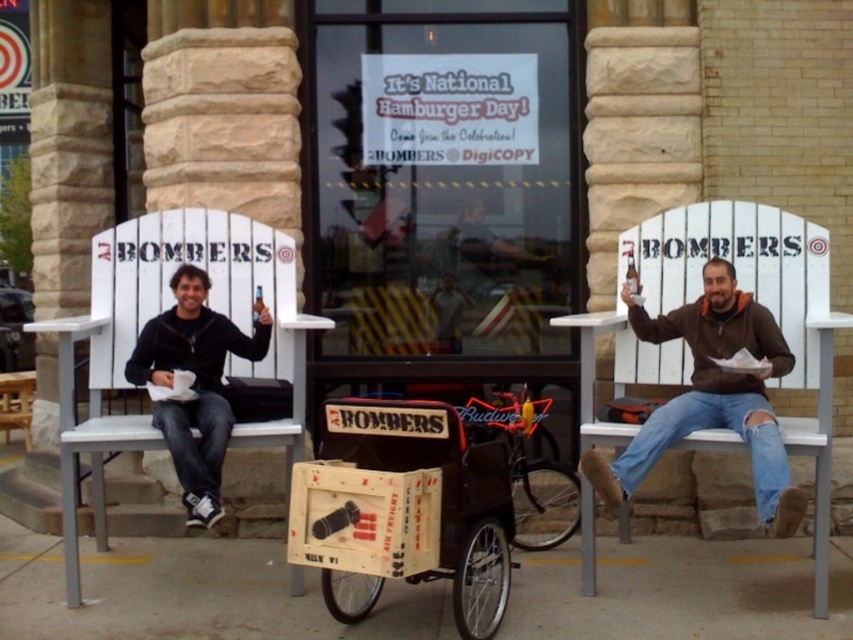
Does brown fuzzy jacket at right have a lesser width compared to neon red sign at center?

In fact, brown fuzzy jacket at right might be wider than neon red sign at center.

Between brown fuzzy jacket at right and neon red sign at center, which one has less height?

neon red sign at center

Between point (782, 538) and point (525, 474), which one is positioned in front?

Point (782, 538)

Where is `brown fuzzy jacket at right`? The width and height of the screenshot is (853, 640). brown fuzzy jacket at right is located at coordinates (711, 396).

Is white painted wood bench at left closer to the viewer compared to black matte jacket at left?

No.

At what (x,y) coordinates should I click in order to perform the action: click on white painted wood bench at left. Please return your answer as a coordinate pair (x, y). Image resolution: width=853 pixels, height=640 pixels. Looking at the image, I should click on (158, 307).

At what (x,y) coordinates should I click in order to perform the action: click on white painted wood bench at left. Please return your answer as a coordinate pair (x, y). The height and width of the screenshot is (640, 853). Looking at the image, I should click on (158, 307).

Which is more to the right, white painted wood bench at left or brown fuzzy jacket at right?

brown fuzzy jacket at right

Where is `white painted wood bench at left`? white painted wood bench at left is located at coordinates (158, 307).